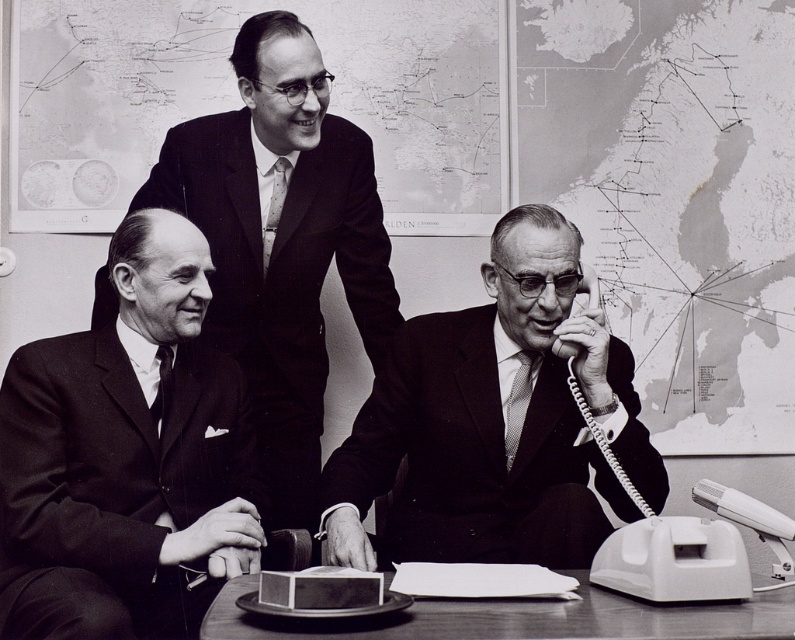
Does matte black suit at left appear over smooth wooden table at lower center?

Yes.

Which is in front, point (99, 589) or point (477, 604)?

Point (477, 604)

Where is `matte black suit at left`? The height and width of the screenshot is (640, 795). matte black suit at left is located at coordinates (125, 456).

Is point (280, 352) closer to camera compared to point (227, 596)?

That is False.

Between point (251, 323) and point (636, 632), which one is positioned in front?

Point (636, 632) is more forward.

Is point (297, 298) positioned after point (591, 596)?

Yes, point (297, 298) is farther from viewer.

Locate an element on the screen. The height and width of the screenshot is (640, 795). matte black suit at upper center is located at coordinates (281, 243).

Does matte black suit at center have a lesser height compared to matte black suit at upper center?

Correct, matte black suit at center is not as tall as matte black suit at upper center.

You are a GUI agent. You are given a task and a screenshot of the screen. Output one action in this format:
    pyautogui.click(x=<x>, y=<y>)
    Task: Click on the matte black suit at center
    This screenshot has width=795, height=640.
    Given the screenshot: What is the action you would take?
    pyautogui.click(x=495, y=422)

Who is more forward, (328, 508) or (237, 276)?

Point (328, 508) is more forward.

The width and height of the screenshot is (795, 640). Find the location of `matte black suit at center`. matte black suit at center is located at coordinates (495, 422).